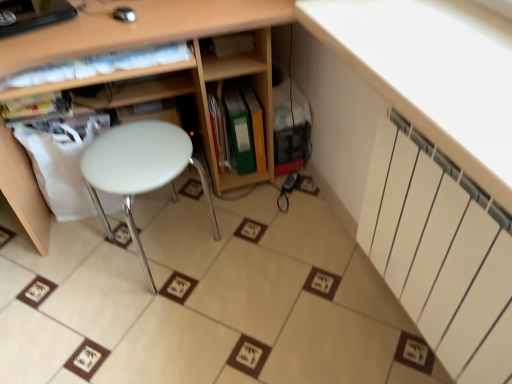
Locate an element on the screen. This screenshot has height=384, width=512. vacant space to the right of white plastic stool at center is located at coordinates (258, 246).